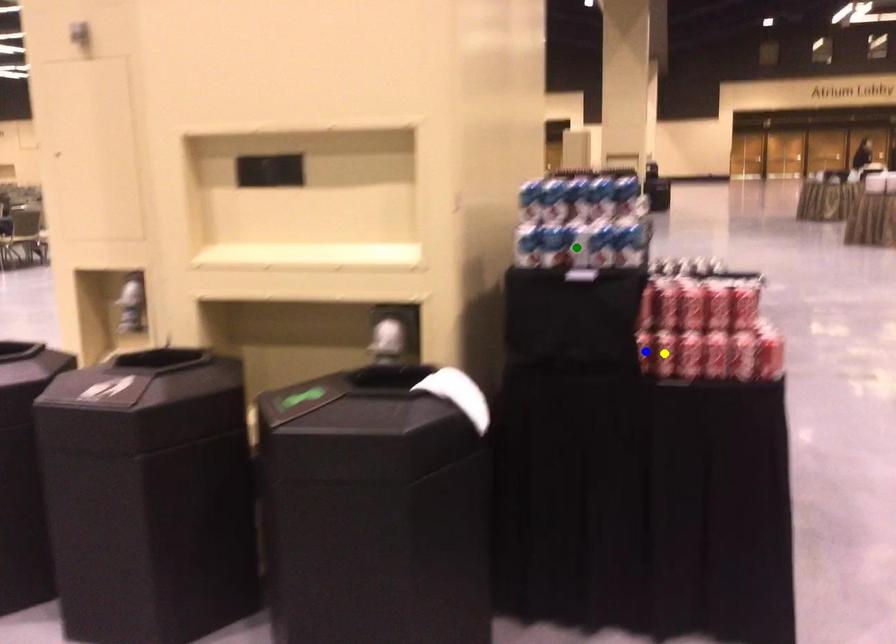
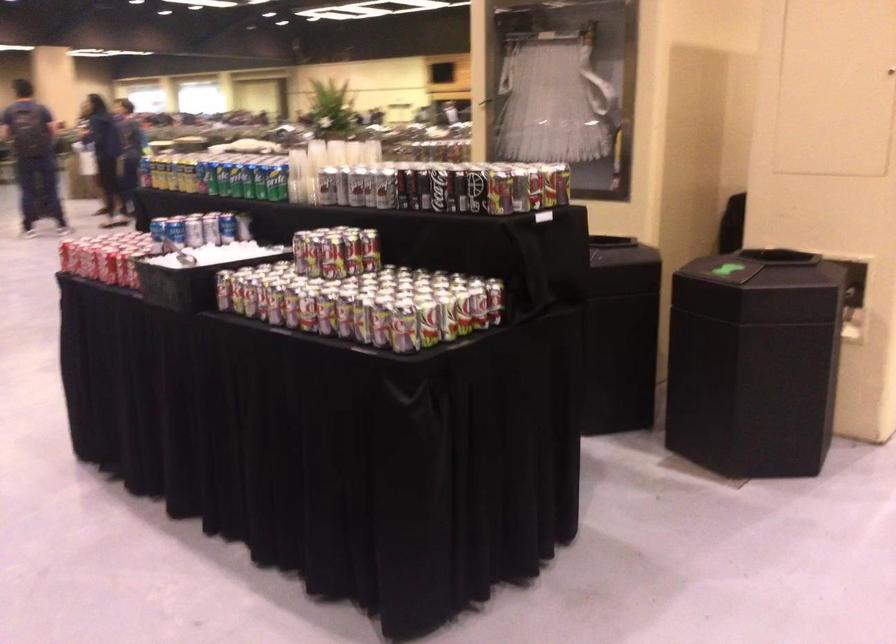
I am providing you with two images of the same scene from different viewpoints. Three points are marked in image1. Which point corresponds to a part or object that is occluded in image2?In image1, three points are marked. Which of them correspond to a part or object that is occluded in image2?Among the three points shown in image1, which one corresponds to a part or object that is no longer visible due to occlusion in image2?

Invisible in image2: yellow point, green point, blue point.